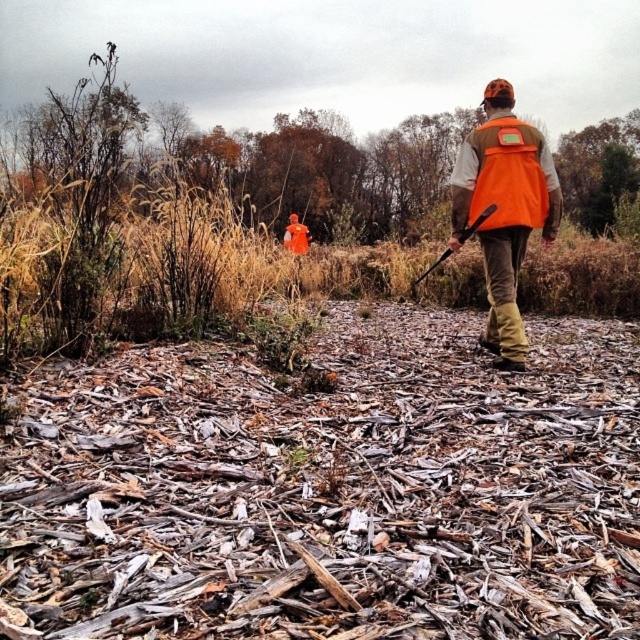
Question: Which object appears closest to the camera in this image?

Choices:
 (A) orange matte safety vest at center
 (B) orange fabric vest at center

Answer: (A)

Question: Is orange fabric vest at center below orange matte safety vest at center?

Choices:
 (A) no
 (B) yes

Answer: (A)

Question: Is orange fabric vest at center bigger than orange matte safety vest at center?

Choices:
 (A) no
 (B) yes

Answer: (B)

Question: Which object is closer to the camera taking this photo?

Choices:
 (A) orange fabric vest at center
 (B) orange matte safety vest at center

Answer: (B)

Question: Does orange fabric vest at center have a greater width compared to orange matte safety vest at center?

Choices:
 (A) no
 (B) yes

Answer: (B)